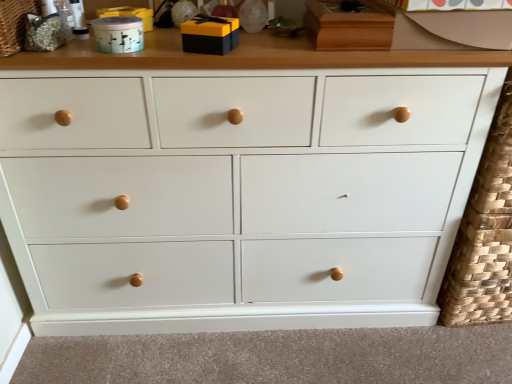
The height and width of the screenshot is (384, 512). What are the coordinates of `vacant region to the left of matte teal ceramic container at upper left, acting as the first toy starting from the left` in the screenshot? It's located at (70, 55).